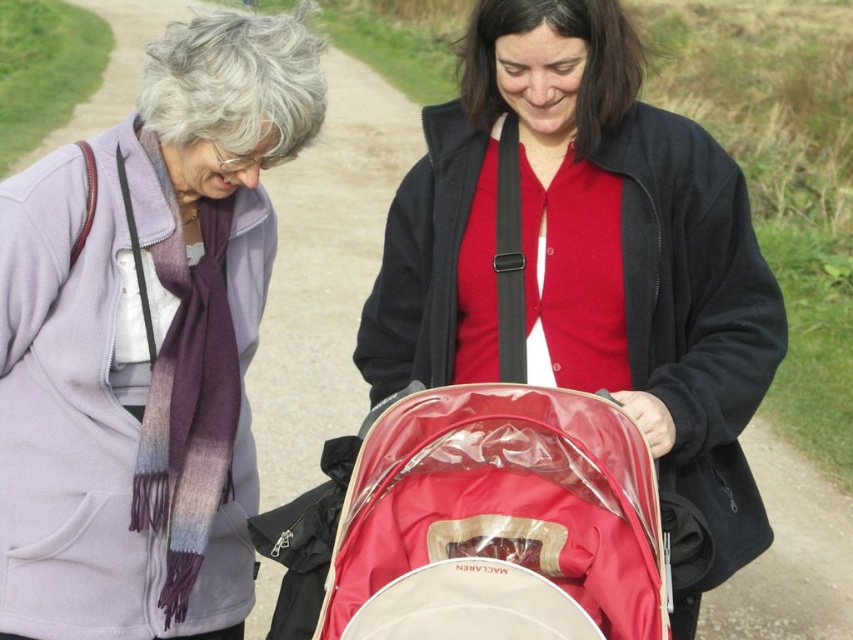
Between matte purple scarf at upper left and red fabric baby carriage at center, which one is positioned lower?

red fabric baby carriage at center is lower down.

Between point (473, 38) and point (616, 588), which one is positioned in front?

Point (616, 588) is more forward.

Identify the location of matte purple scarf at upper left. The width and height of the screenshot is (853, 640). (589, 257).

Which is below, purple wool scarf at left or matte purple scarf at upper left?

Positioned lower is purple wool scarf at left.

Is point (102, 625) in front of point (628, 49)?

Yes, point (102, 625) is in front of point (628, 49).

Measure the distance between purple wool scarf at left and camera.

purple wool scarf at left is 8.00 feet from camera.

Locate an element on the screen. The height and width of the screenshot is (640, 853). purple wool scarf at left is located at coordinates (144, 342).

Is purple wool scarf at left to the left of red fabric baby carriage at center from the viewer's perspective?

Indeed, purple wool scarf at left is positioned on the left side of red fabric baby carriage at center.

Is purple wool scarf at left positioned behind red fabric baby carriage at center?

Yes, it is.

What do you see at coordinates (144, 342) in the screenshot?
I see `purple wool scarf at left` at bounding box center [144, 342].

Where is `purple wool scarf at left`? purple wool scarf at left is located at coordinates (144, 342).